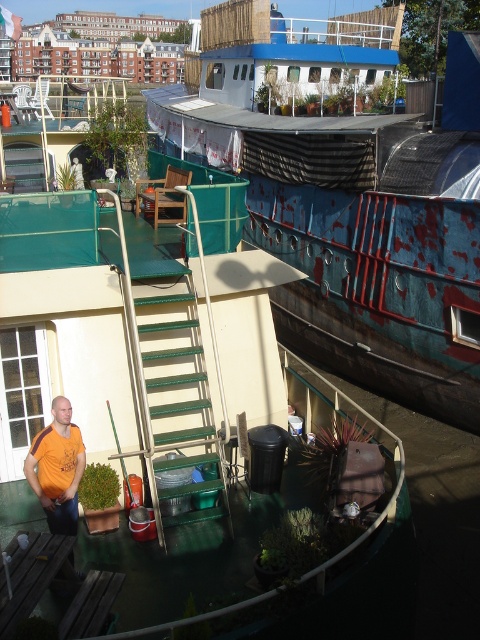
Question: Which of the following is the farthest from the observer?

Choices:
 (A) (187, 449)
 (B) (210, 19)
 (C) (79, 461)

Answer: (B)

Question: Does rusty metal boat at center appear under orange t-shirt at lower left?

Choices:
 (A) no
 (B) yes

Answer: (A)

Question: Does rusty metal boat at center come in front of green metal stairs at center?

Choices:
 (A) yes
 (B) no

Answer: (B)

Question: Which point appears farthest from the camera in this image?

Choices:
 (A) (349, 292)
 (B) (168, 467)
 (C) (74, 440)

Answer: (A)

Question: Estimate the real-world distances between objects in this image. Which object is farther from the green metal stairs at center?

Choices:
 (A) rusty metal boat at center
 (B) orange t-shirt at lower left

Answer: (A)

Question: Is rusty metal boat at center positioned at the back of orange t-shirt at lower left?

Choices:
 (A) yes
 (B) no

Answer: (A)